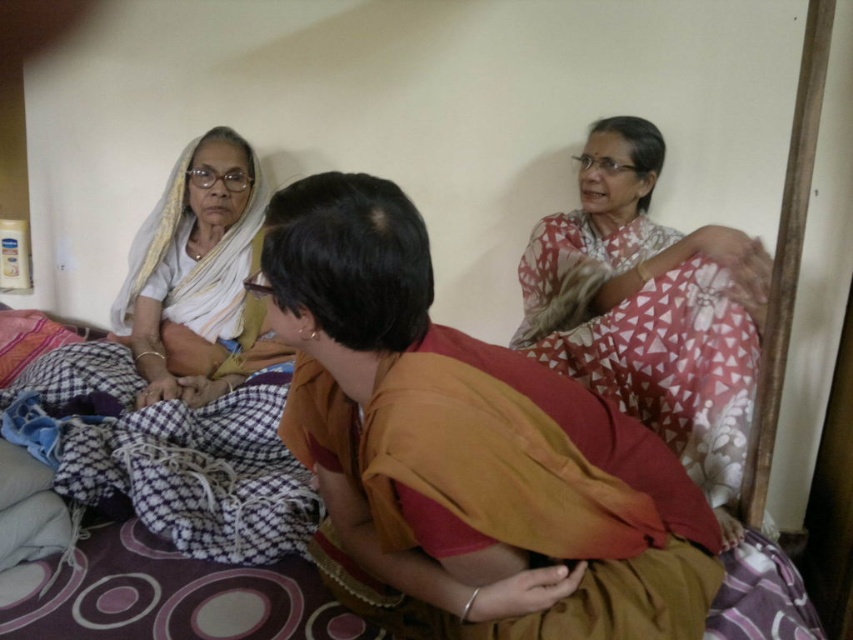
Which is below, orange cotton saree at center or white fabric sari at left?

orange cotton saree at center is lower down.

Can you confirm if orange cotton saree at center is positioned below white fabric sari at left?

Yes, orange cotton saree at center is below white fabric sari at left.

Who is more forward, (596,465) or (189,192)?

Point (596,465)

At what (x,y) coordinates should I click in order to perform the action: click on orange cotton saree at center. Please return your answer as a coordinate pair (x, y). This screenshot has width=853, height=640. Looking at the image, I should click on (467, 445).

Between orange cotton saree at center and printed cotton saree at upper right, which one appears on the right side from the viewer's perspective?

Positioned to the right is printed cotton saree at upper right.

Does orange cotton saree at center come in front of printed cotton saree at upper right?

Yes, it is in front of printed cotton saree at upper right.

Where is `orange cotton saree at center`? orange cotton saree at center is located at coordinates (467, 445).

Does printed cotton saree at upper right come in front of white fabric sari at left?

That is True.

Does point (566, 368) lie behind point (216, 218)?

No, (566, 368) is closer to viewer.

Where is `printed cotton saree at upper right`? Image resolution: width=853 pixels, height=640 pixels. printed cotton saree at upper right is located at coordinates pyautogui.click(x=650, y=308).